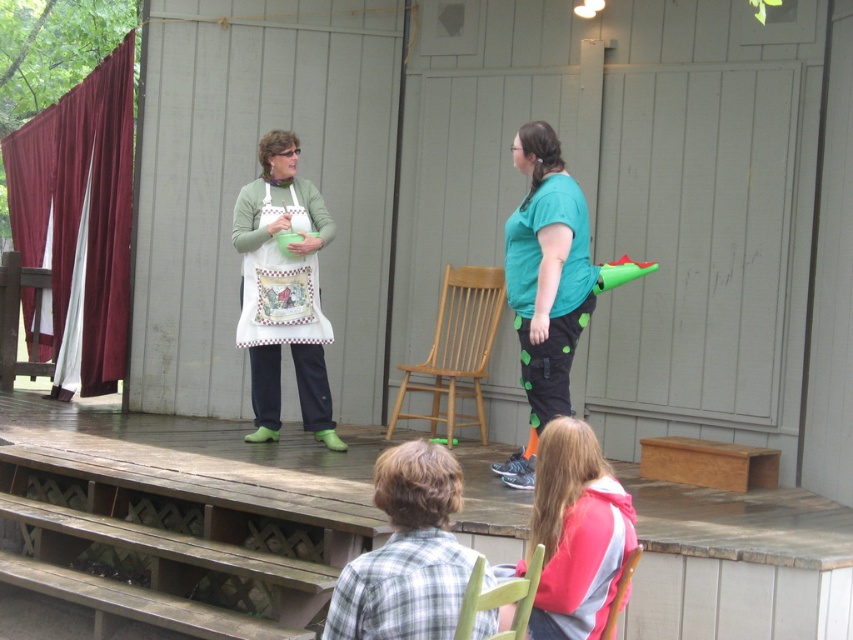
Question: Can you confirm if plaid shirt at lower center is positioned below wooden chair at center?

Choices:
 (A) no
 (B) yes

Answer: (B)

Question: Which point is closer to the camera?

Choices:
 (A) (357, 563)
 (B) (643, 586)

Answer: (A)

Question: Does wooden stage at center have a greater width compared to green matte pants at center?

Choices:
 (A) yes
 (B) no

Answer: (A)

Question: Does pink fleece jacket at lower center lie in front of white printed apron at center?

Choices:
 (A) no
 (B) yes

Answer: (B)

Question: Among these points, which one is farthest from the camera?

Choices:
 (A) click(x=460, y=330)
 (B) click(x=39, y=189)
 (C) click(x=416, y=481)

Answer: (B)

Question: Estimate the real-world distances between objects in this image. Which object is farther from the white printed apron at center?

Choices:
 (A) wooden chair at lower center
 (B) pink fleece jacket at lower center
 (C) maroon velvet curtain at left

Answer: (A)